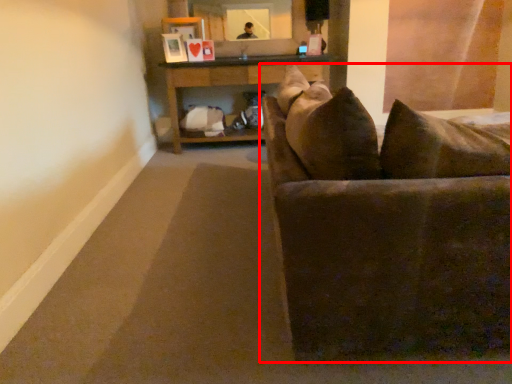
Question: Considering the relative positions of studio couch (annotated by the red box) and table in the image provided, where is studio couch (annotated by the red box) located with respect to the staircase?

Choices:
 (A) right
 (B) left

Answer: (A)